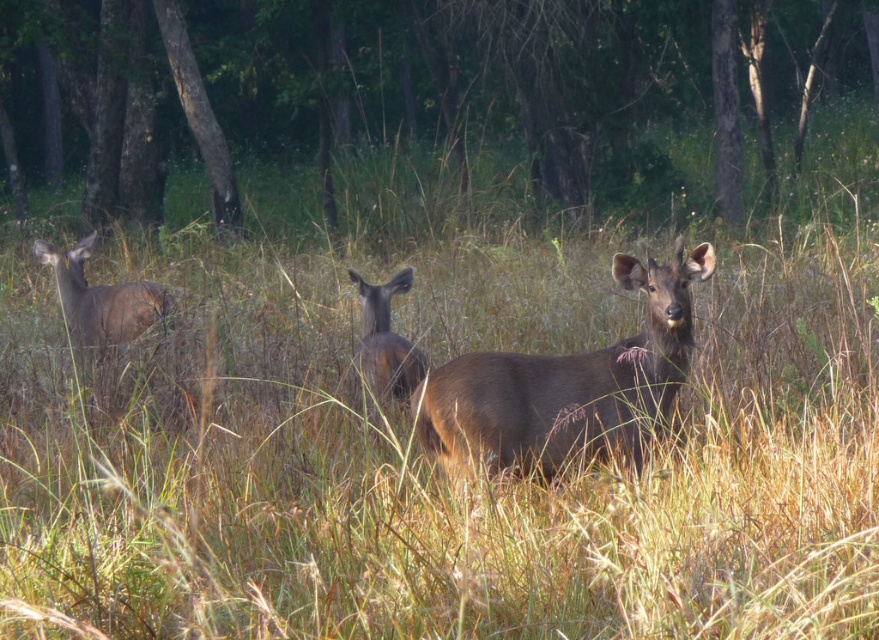
You are a wildlife photographer aiming to capture a photo of the brown matte deer at center. You want to ensure the deer is in focus while keeping the background slightly blurred. Based on their positions, which deer should you focus on to achieve this effect?

You should focus on the brown matte deer at center because it is positioned closer to the viewer compared to the other deer, allowing for a shallow depth of field that keeps the background blurred while keeping the subject in focus.

You are a wildlife photographer trying to capture the tallest deer in the scene. Which deer should you focus on between the brown matte deer at center and the brown matte deer at left?

The brown matte deer at center is taller than the brown matte deer at left, so you should focus on the brown matte deer at center to capture the tallest deer.